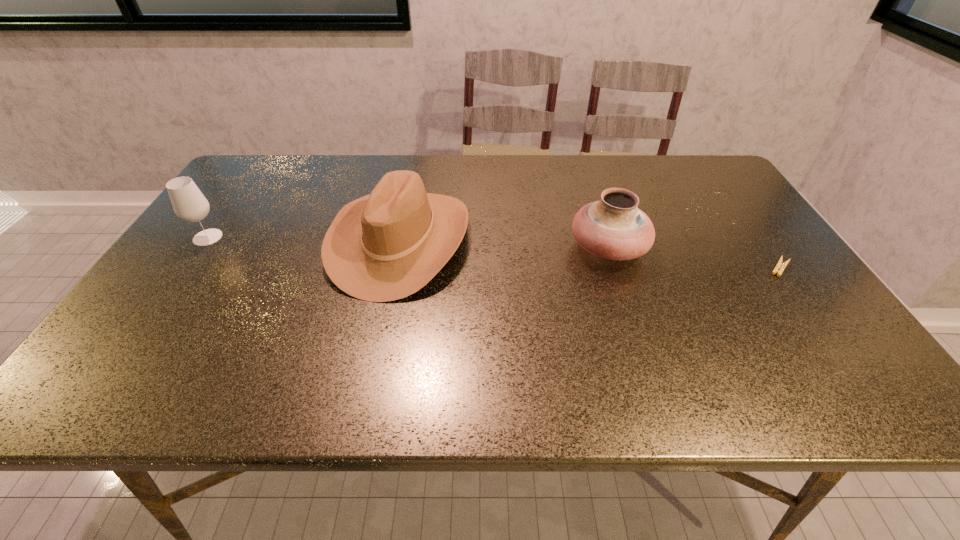
Find the location of `object at the left edge`. object at the left edge is located at coordinates (189, 204).

At what (x,y) coordinates should I click in order to perform the action: click on object situated at the right edge. Please return your answer as a coordinate pair (x, y). The height and width of the screenshot is (540, 960). Looking at the image, I should click on (780, 264).

Locate an element on the screen. The width and height of the screenshot is (960, 540). free space at the far edge is located at coordinates (328, 174).

This screenshot has height=540, width=960. What are the coordinates of `vacant space at the near edge of the desktop` in the screenshot? It's located at [x=361, y=390].

Find the location of a particular element. The width and height of the screenshot is (960, 540). free space at the left edge of the desktop is located at coordinates (221, 213).

This screenshot has width=960, height=540. In the image, there is a desktop. What are the coordinates of `vacant space at the right edge` in the screenshot? It's located at (734, 246).

Where is `vacant space at the far left corner of the desktop`? The height and width of the screenshot is (540, 960). vacant space at the far left corner of the desktop is located at coordinates (249, 169).

Where is `free space between the pottery and the cowboy hat`? The height and width of the screenshot is (540, 960). free space between the pottery and the cowboy hat is located at coordinates (504, 244).

I want to click on free spot between the cowboy hat and the pottery, so click(504, 244).

At what (x,y) coordinates should I click in order to perform the action: click on free point between the pottery and the cowboy hat. Please return your answer as a coordinate pair (x, y). The image size is (960, 540). Looking at the image, I should click on (504, 244).